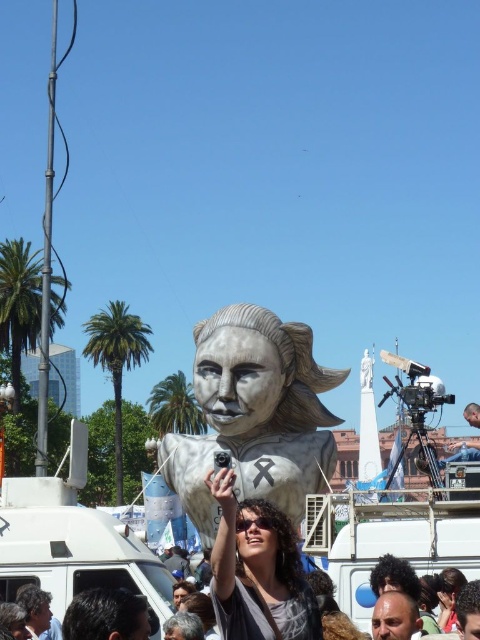
Question: Does white glossy statue at center have a larger size compared to matte gray statue at center?

Choices:
 (A) yes
 (B) no

Answer: (B)

Question: Estimate the real-world distances between objects in this image. Which object is closer to the matte silver statue at center?

Choices:
 (A) matte gray statue at center
 (B) white glossy statue at center

Answer: (A)

Question: Estimate the real-world distances between objects in this image. Which object is closer to the matte gray statue at center?

Choices:
 (A) matte silver statue at center
 (B) white glossy statue at center

Answer: (B)

Question: Estimate the real-world distances between objects in this image. Which object is farther from the matte gray statue at center?

Choices:
 (A) white glossy statue at center
 (B) matte silver statue at center

Answer: (B)

Question: Is white glossy statue at center bigger than matte silver statue at center?

Choices:
 (A) yes
 (B) no

Answer: (A)

Question: Is the position of white glossy statue at center more distant than that of matte silver statue at center?

Choices:
 (A) yes
 (B) no

Answer: (A)